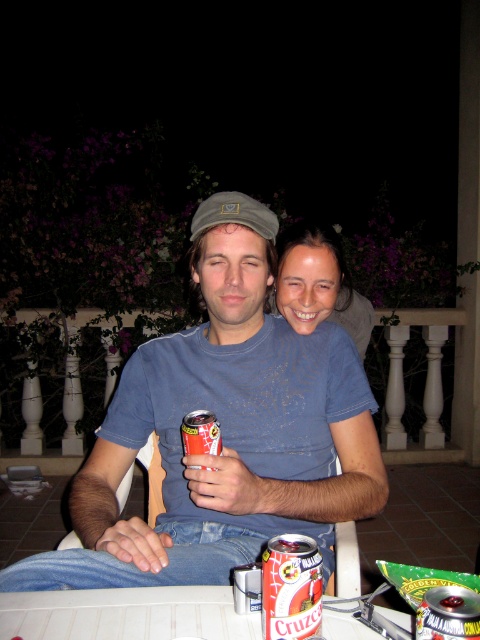
Does matte blue t-shirt at center have a larger size compared to metallic red can at center?

Indeed, matte blue t-shirt at center has a larger size compared to metallic red can at center.

Does matte blue t-shirt at center have a greater width compared to metallic red can at center?

Indeed, matte blue t-shirt at center has a greater width compared to metallic red can at center.

Who is more forward, (254, 444) or (187, 440)?

Positioned in front is point (187, 440).

Find the location of a particular element. The height and width of the screenshot is (640, 480). matte blue t-shirt at center is located at coordinates (224, 432).

How far apart are white plastic table at lower center and crimson matte can at lower center?

white plastic table at lower center is 5.99 inches from crimson matte can at lower center.

Between white plastic table at lower center and crimson matte can at lower center, which one appears on the left side from the viewer's perspective?

white plastic table at lower center

Is point (184, 605) positioned behind point (286, 614)?

Yes, it is.

The width and height of the screenshot is (480, 640). Identify the location of white plastic table at lower center. (126, 614).

How distant is matte blue t-shirt at center from metallic silver can at center?

matte blue t-shirt at center and metallic silver can at center are 23.41 inches apart.

Is matte blue t-shirt at center shorter than metallic silver can at center?

Incorrect, matte blue t-shirt at center's height does not fall short of metallic silver can at center's.

Is point (347, 440) closer to viewer compared to point (433, 608)?

No, it is behind (433, 608).

The width and height of the screenshot is (480, 640). In order to click on matte blue t-shirt at center in this screenshot , I will do `click(224, 432)`.